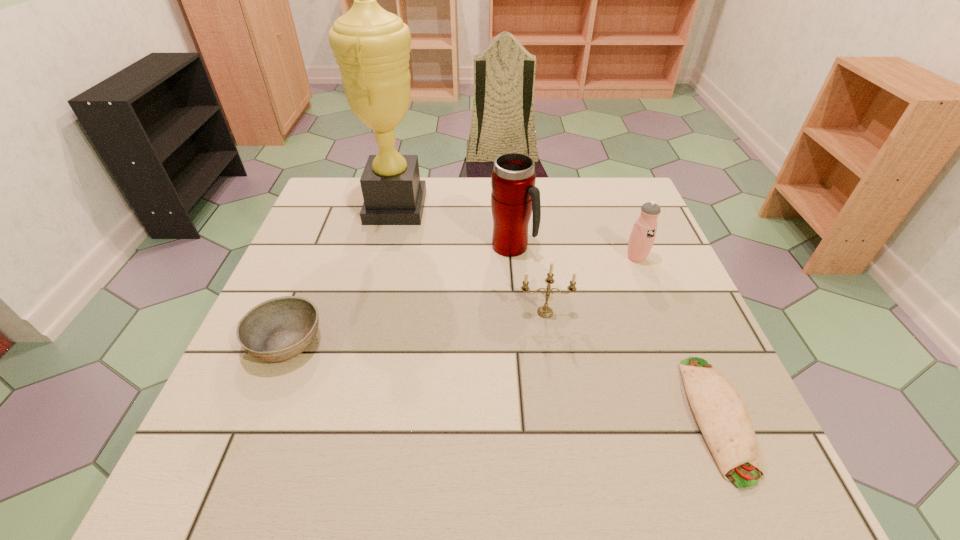
The width and height of the screenshot is (960, 540). In order to click on free space located 0.260m on the left of the candle in this screenshot , I will do `click(400, 312)`.

At what (x,y) coordinates should I click in order to perform the action: click on vacant space positioned 0.330m on the back of the fifth tallest object. Please return your answer as a coordinate pair (x, y). The width and height of the screenshot is (960, 540). Looking at the image, I should click on tap(334, 225).

Where is `object located in the far edge section of the desktop`? The image size is (960, 540). object located in the far edge section of the desktop is located at coordinates (371, 45).

This screenshot has height=540, width=960. What are the coordinates of `object situated at the near edge` in the screenshot? It's located at (721, 414).

Image resolution: width=960 pixels, height=540 pixels. What are the coordinates of `trophy cup present at the left edge` in the screenshot? It's located at (371, 45).

This screenshot has width=960, height=540. Find the location of `bowl located in the left edge section of the desktop`. bowl located in the left edge section of the desktop is located at coordinates (278, 329).

Identify the location of thermos bottle at the right edge. (642, 236).

Locate an element on the screen. Image resolution: width=960 pixels, height=540 pixels. burrito situated at the right edge is located at coordinates (721, 414).

You are a GUI agent. You are given a task and a screenshot of the screen. Output one action in this format:
    pyautogui.click(x=<x>, y=<y>)
    Task: Click on the object located at the far left corner
    This screenshot has width=960, height=540.
    Given the screenshot: What is the action you would take?
    pyautogui.click(x=371, y=45)

Find the location of a particular element. The image size is (960, 540). object positioned at the near right corner is located at coordinates (721, 414).